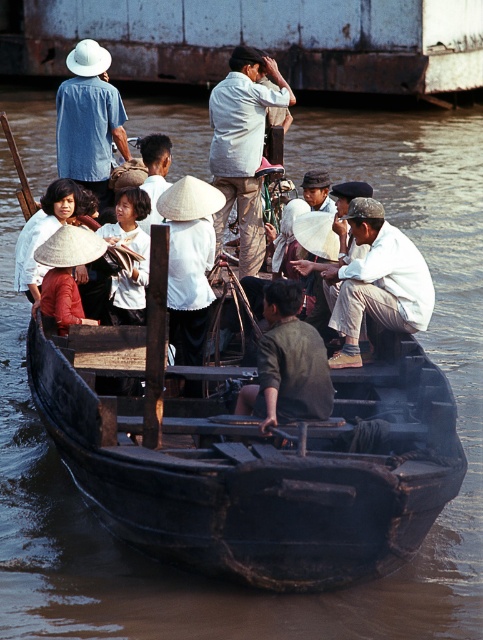
Which of these two, white cotton hat at center or light beige cotton shirt at center, stands shorter?

white cotton hat at center is shorter.

Does point (401, 246) come farther from viewer compared to point (252, 128)?

No, (401, 246) is closer to viewer.

The width and height of the screenshot is (483, 640). Identify the location of white cotton hat at center. (377, 282).

Is black wooden boat at center above light beige cotton shirt at center?

Incorrect, black wooden boat at center is not positioned above light beige cotton shirt at center.

Who is positioned more to the left, black wooden boat at center or light beige cotton shirt at center?

light beige cotton shirt at center is more to the left.

The image size is (483, 640). What do you see at coordinates (261, 470) in the screenshot?
I see `black wooden boat at center` at bounding box center [261, 470].

I want to click on black wooden boat at center, so click(261, 470).

Is white cotton hat at center bigger than white woven hat at center?

Correct, white cotton hat at center is larger in size than white woven hat at center.

Is point (361, 301) closer to camera compared to point (175, 192)?

Yes, it is in front of point (175, 192).

Image resolution: width=483 pixels, height=640 pixels. What do you see at coordinates (377, 282) in the screenshot?
I see `white cotton hat at center` at bounding box center [377, 282].

Identify the location of white cotton hat at center. (377, 282).